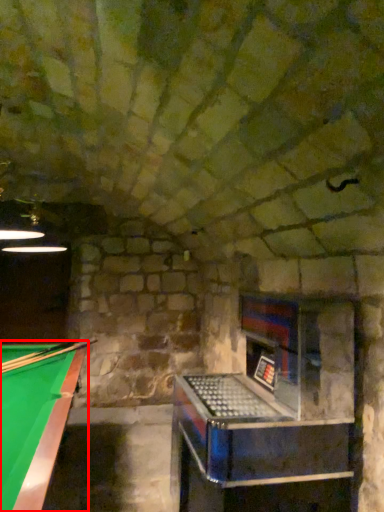
Question: From the image's perspective, considering the relative positions of billiard table (annotated by the red box) and cue in the image provided, where is billiard table (annotated by the red box) located with respect to the staircase?

Choices:
 (A) above
 (B) below

Answer: (B)